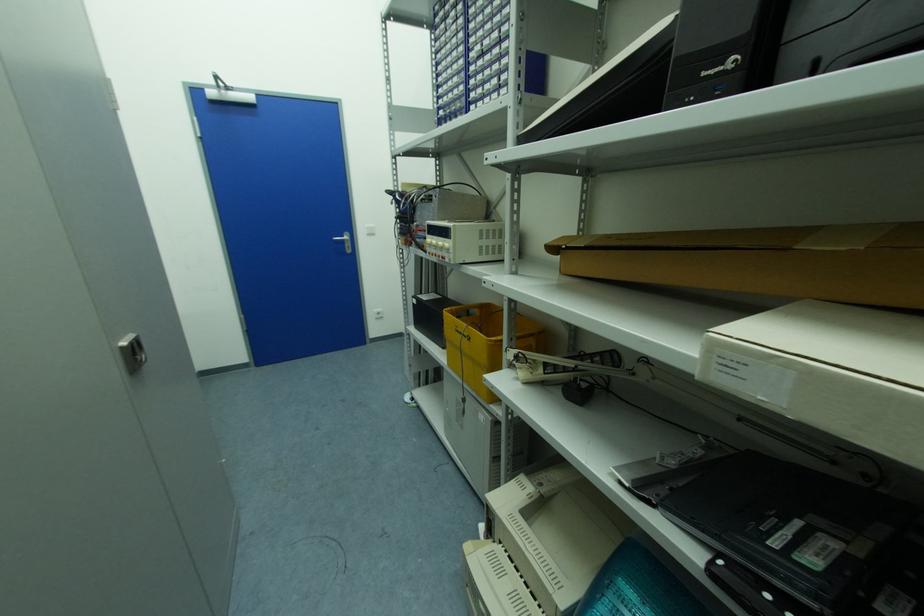
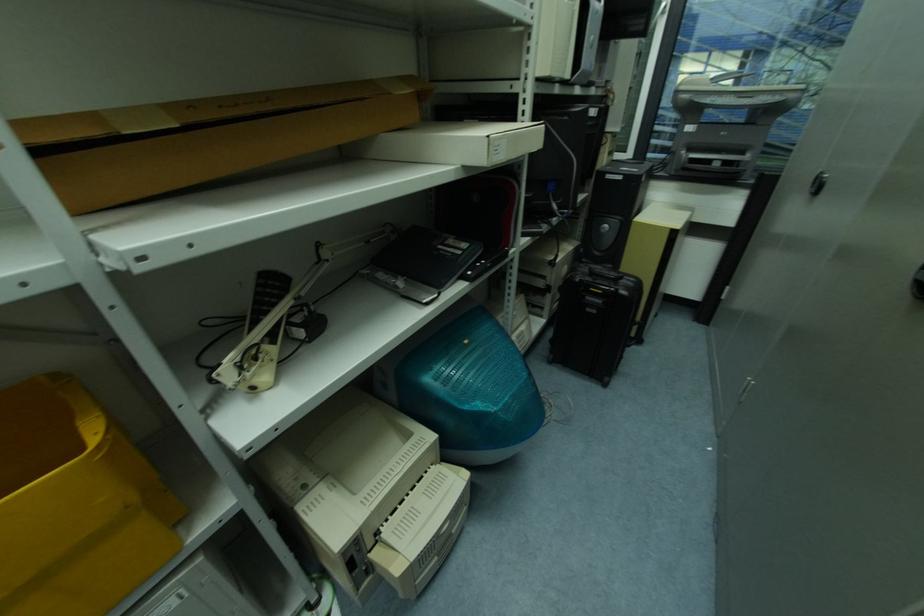
First-person continuous shooting, in which direction is the camera rotating?

The camera rotated toward right-down.